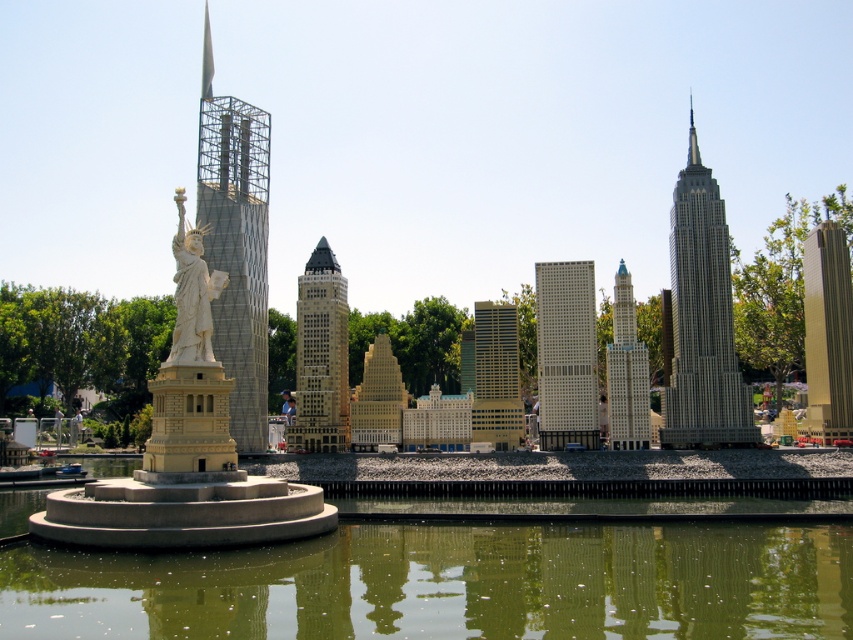
Question: Is white concrete fountain at left to the left of white stone statue at center from the viewer's perspective?

Choices:
 (A) no
 (B) yes

Answer: (B)

Question: Which object is the closest to the gold metallic building at center?

Choices:
 (A) gold metallic tower at right
 (B) brick textured building at center
 (C) green reflective water at center

Answer: (B)

Question: Does metallic silver tower at center-left come behind white textured building at center?

Choices:
 (A) no
 (B) yes

Answer: (A)

Question: Estimate the real-world distances between objects in this image. Which object is farther from the metallic silver tower at center-left?

Choices:
 (A) matte gray skyscraper at center right
 (B) gold metallic tower at right

Answer: (B)

Question: Which point is farther to the camera?

Choices:
 (A) (190, 259)
 (B) (329, 412)

Answer: (B)

Question: Considering the relative positions of green reflective water at center and yellow brick building at center in the image provided, where is green reflective water at center located with respect to yellow brick building at center?

Choices:
 (A) left
 (B) right

Answer: (B)